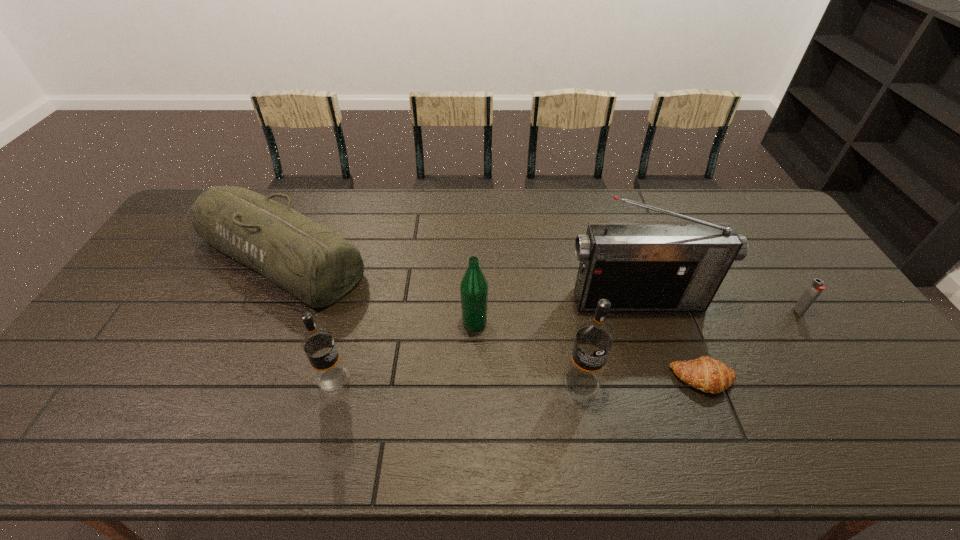
The vodkas are evenly distributed in the image. To maintain this, where would you place another vodka on the right? Please point to a free space. Please provide its 2D coordinates. Your answer should be formatted as a tuple, i.e. [(x, y)], where the tuple contains the x and y coordinates of a point satisfying the conditions above.

[(831, 384)]